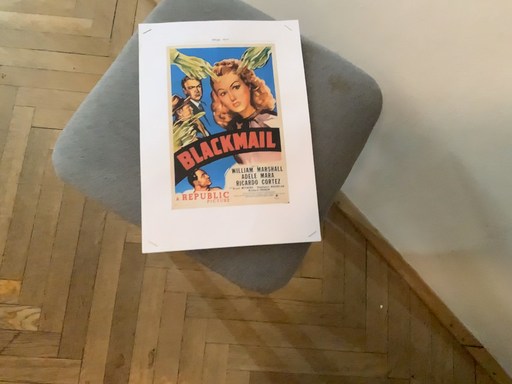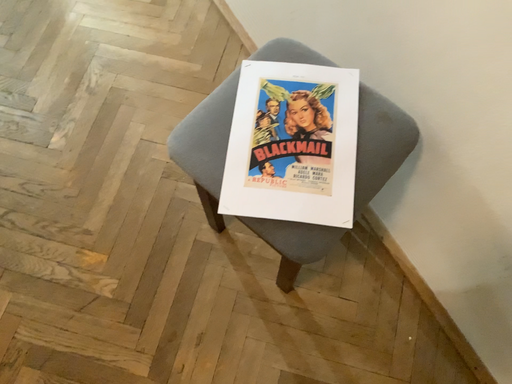
Question: Which way did the camera rotate in the video?

Choices:
 (A) rotated left
 (B) rotated right

Answer: (A)